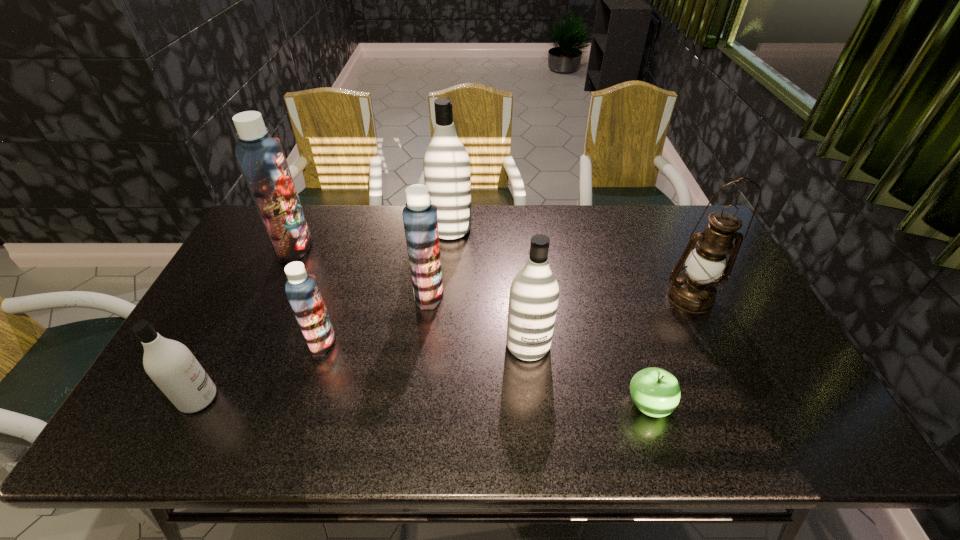
Identify which blue shampoo is the second closest to the second farthest white shampoo. Please provide its 2D coordinates. Your answer should be formatted as a tuple, i.e. [(x, y)], where the tuple contains the x and y coordinates of a point satisfying the conditions above.

[(302, 290)]

Find the location of a particular element. The image size is (960, 540). blue shampoo that is the second nearest to the third shampoo from left to right is located at coordinates point(261,158).

The width and height of the screenshot is (960, 540). What are the coordinates of `free location that satisfies the following two spatial constraints: 1. on the front label of the fourth shampoo from right to left; 2. on the back side of the second object from right to left` in the screenshot? It's located at (302, 405).

I want to click on free location that satisfies the following two spatial constraints: 1. on the front label of the second blue shampoo from left to right; 2. on the left side of the apple, so click(302, 405).

Locate an element on the screen. The width and height of the screenshot is (960, 540). free space that satisfies the following two spatial constraints: 1. on the front label of the green apple; 2. on the left side of the rightmost blue shampoo is located at coordinates (416, 405).

This screenshot has width=960, height=540. Identify the location of free space that satisfies the following two spatial constraints: 1. on the front-facing side of the biggest white shampoo; 2. on the left side of the oil lamp. (445, 296).

Locate an element on the screen. This screenshot has width=960, height=540. vacant space that satisfies the following two spatial constraints: 1. on the front label of the second object from right to left; 2. on the left side of the farthest blue shampoo is located at coordinates (222, 405).

Find the location of a particular element. This screenshot has width=960, height=540. free location that satisfies the following two spatial constraints: 1. on the front-facing side of the farthest white shampoo; 2. on the back side of the green apple is located at coordinates (437, 405).